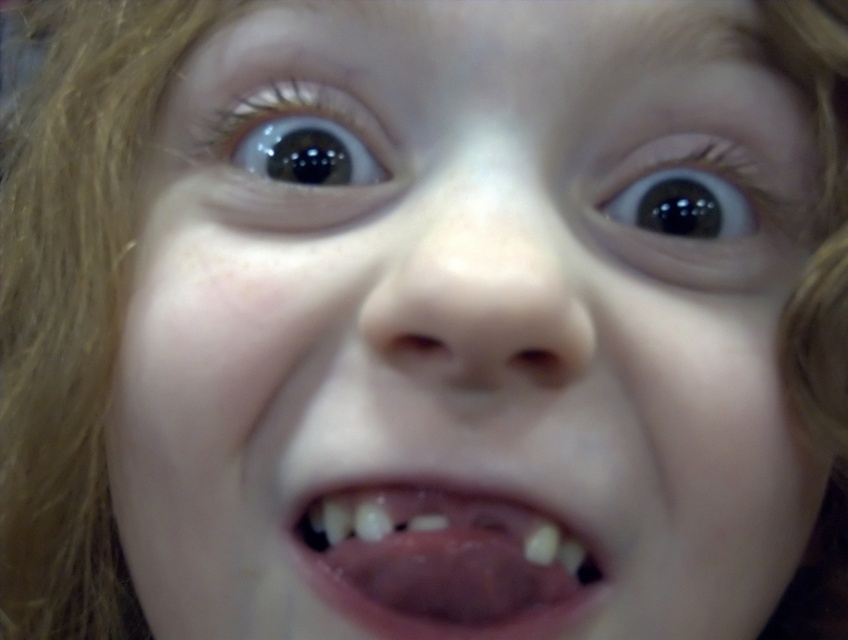
Question: Which object is the farthest from the brown glossy eye at upper right?

Choices:
 (A) yellowish toothpaste at center
 (B) brown glossy eye at upper center

Answer: (A)

Question: Is yellowish toothpaste at center positioned at the back of brown glossy eye at upper right?

Choices:
 (A) yes
 (B) no

Answer: (B)

Question: Which is farther from the brown glossy eye at upper center?

Choices:
 (A) brown glossy eye at upper right
 (B) yellowish toothpaste at center

Answer: (A)

Question: Where is yellowish toothpaste at center located in relation to brown glossy eye at upper center in the image?

Choices:
 (A) left
 (B) right

Answer: (B)

Question: Estimate the real-world distances between objects in this image. Which object is farther from the brown glossy eye at upper center?

Choices:
 (A) brown glossy eye at upper right
 (B) yellowish toothpaste at center

Answer: (A)

Question: Is yellowish toothpaste at center thinner than brown glossy eye at upper right?

Choices:
 (A) no
 (B) yes

Answer: (A)